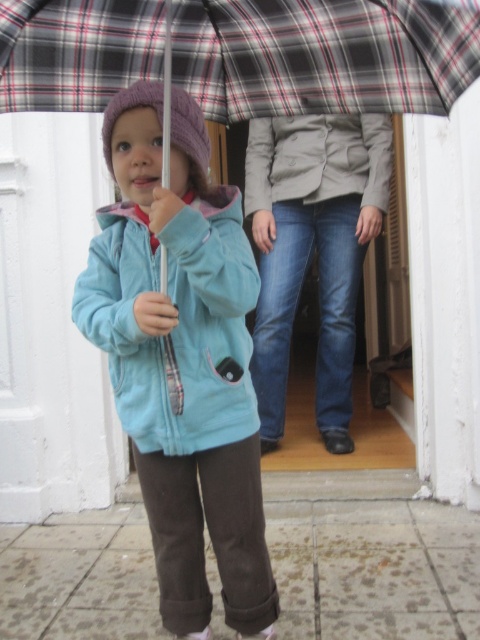
Question: Which object appears closest to the camera in this image?

Choices:
 (A) light blue fleece jacket at center
 (B) matte blue jacket at center
 (C) plaid fabric umbrella at upper center

Answer: (C)

Question: Is light blue fleece jacket at center bigger than light gray textured jacket at center?

Choices:
 (A) yes
 (B) no

Answer: (B)

Question: Is light blue fleece jacket at center bigger than light gray textured jacket at center?

Choices:
 (A) no
 (B) yes

Answer: (A)

Question: Among these objects, which one is nearest to the camera?

Choices:
 (A) light gray textured jacket at center
 (B) blue denim jeans at center
 (C) plaid fabric umbrella at upper center
 (D) matte blue jacket at center

Answer: (C)

Question: Which is farther from the matte blue jacket at center?

Choices:
 (A) plaid fabric umbrella at upper center
 (B) blue denim jeans at center

Answer: (B)

Question: Does plaid fabric umbrella at upper center appear on the right side of light blue fleece jacket at center?

Choices:
 (A) no
 (B) yes

Answer: (B)